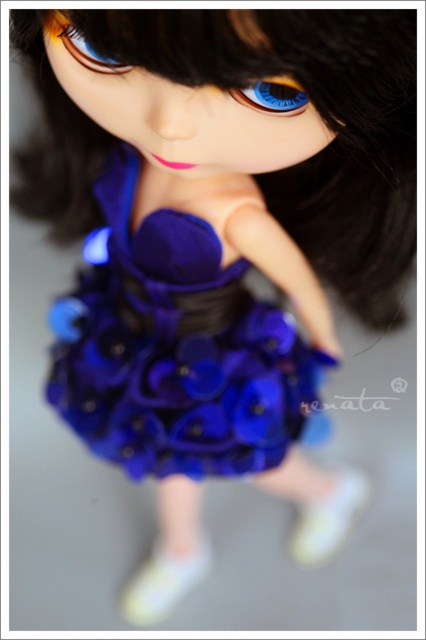
Between white fabric shoe at lower right and blue glossy eye at center, which one appears on the left side from the viewer's perspective?

Positioned to the left is blue glossy eye at center.

Can you confirm if white fabric shoe at lower right is taller than blue glossy eye at center?

Indeed, white fabric shoe at lower right has a greater height compared to blue glossy eye at center.

Where is `white fabric shoe at lower right`? This screenshot has height=640, width=426. white fabric shoe at lower right is located at coordinates (328, 518).

Is white matte socks at lower center shorter than blue glossy eye at center?

In fact, white matte socks at lower center may be taller than blue glossy eye at center.

Does white matte socks at lower center have a smaller size compared to blue glossy eye at center?

Actually, white matte socks at lower center might be larger than blue glossy eye at center.

In order to click on white matte socks at lower center in this screenshot , I will do `click(163, 582)`.

Based on the photo, between white fabric shoe at lower right and white matte socks at lower center, which one is positioned lower?

white matte socks at lower center is below.

What are the coordinates of `white fabric shoe at lower right` in the screenshot? It's located at [x=328, y=518].